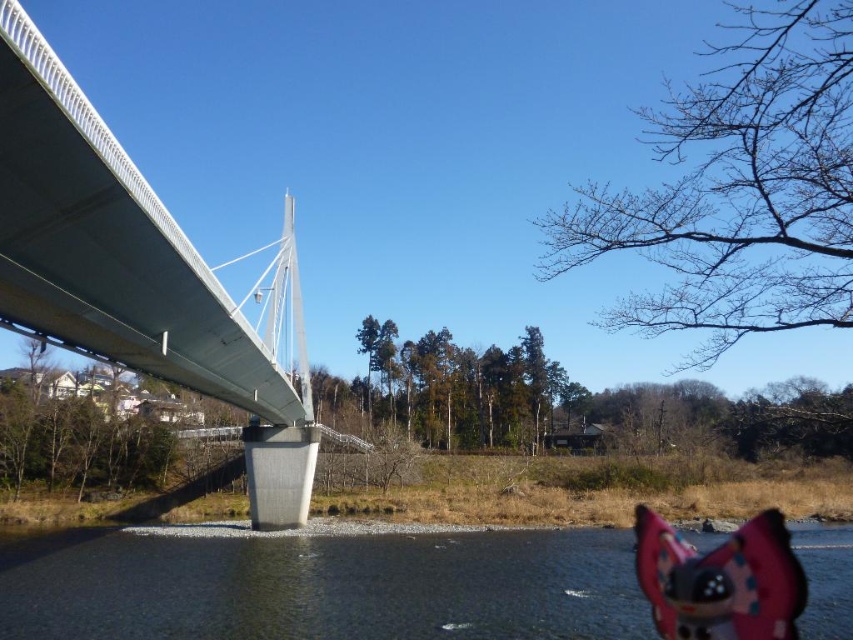
You are a photographer planning to capture the entire scene of the clear water at lower right and the silver metallic suspension bridge at left in one shot. Based on their sizes in the image, which object would require you to adjust your camera angle to include more of it in the frame?

The clear water at lower right requires adjusting the camera angle to include more of it because its width is larger than the silver metallic suspension bridge at left.

You are a photographer trying to capture the silver metallic suspension bridge at left and the clear water at lower right in a single shot. Based on their positions, which object would appear closer to the camera in the photo?

The clear water at lower right would appear closer to the camera since it is in front of the silver metallic suspension bridge at left.

You are standing on the modern bridge and want to find the clear water at lower right. According to the coordinates provided, where should you look relative to your position?

The clear water at lower right is located at coordinates point (323, 586), so you should look towards the lower right direction from your current position on the bridge.